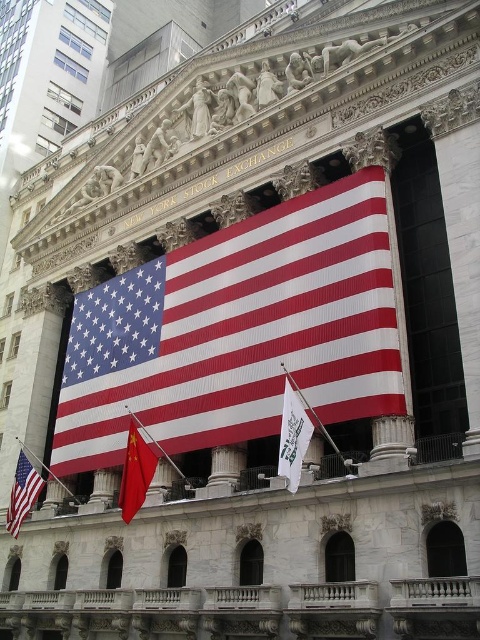
Question: Is red fabric flag at lower center thinner than matte fabric flag at lower left?

Choices:
 (A) yes
 (B) no

Answer: (B)

Question: Does red fabric flag at lower center have a lesser width compared to matte fabric flag at lower left?

Choices:
 (A) yes
 (B) no

Answer: (B)

Question: From the image, what is the correct spatial relationship of red fabric flag at center in relation to matte fabric flag at lower left?

Choices:
 (A) left
 (B) right

Answer: (B)

Question: Which point is farther to the camera?

Choices:
 (A) white fabric flag at center
 (B) red fabric flag at center
 (C) matte fabric flag at lower left
 (D) red fabric flag at lower center

Answer: (C)

Question: Which point is farther to the camera?

Choices:
 (A) white fabric flag at center
 (B) red fabric flag at lower center
 (C) matte fabric flag at lower left
 (D) red fabric flag at center

Answer: (C)

Question: Which of the following is the closest to the observer?

Choices:
 (A) red fabric flag at center
 (B) white fabric flag at center

Answer: (B)